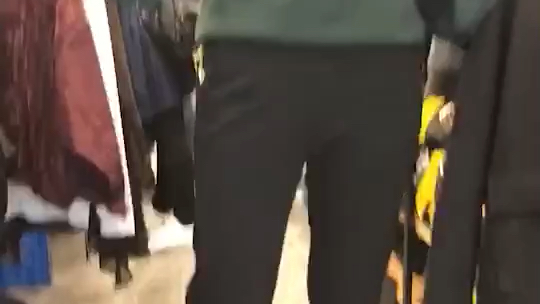
What are the coordinates of `floor` in the screenshot? It's located at (82, 294).